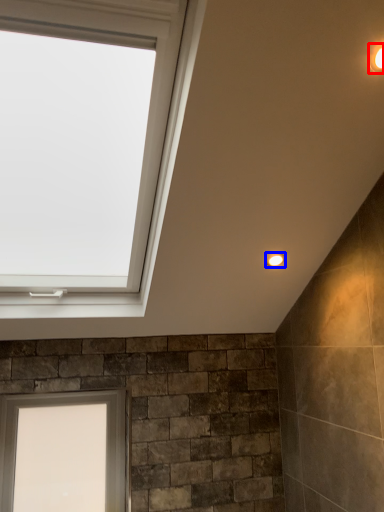
Question: Which of the following is the closest to the observer, light fixture (highlighted by a red box) or light fixture (highlighted by a blue box)?

Choices:
 (A) light fixture
 (B) light fixture

Answer: (A)